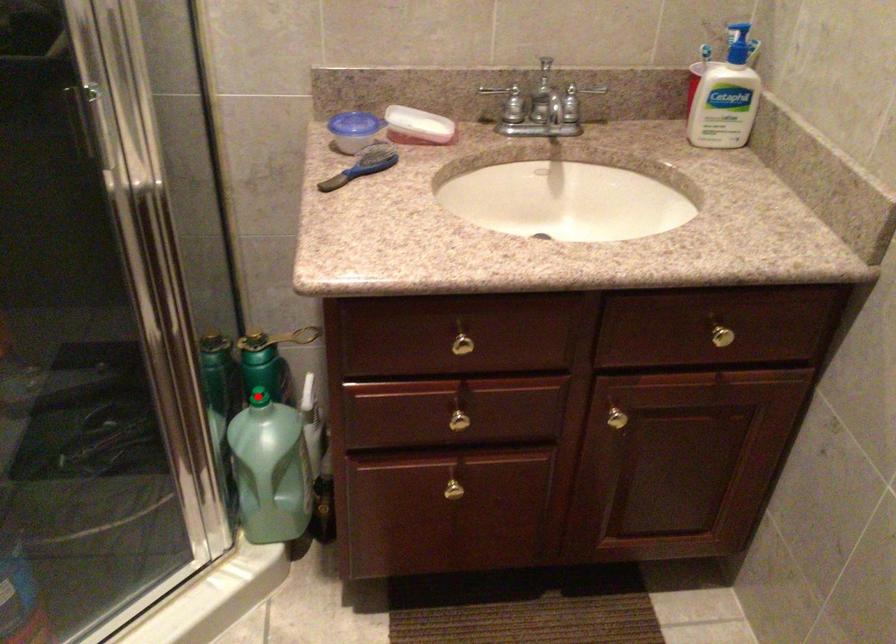
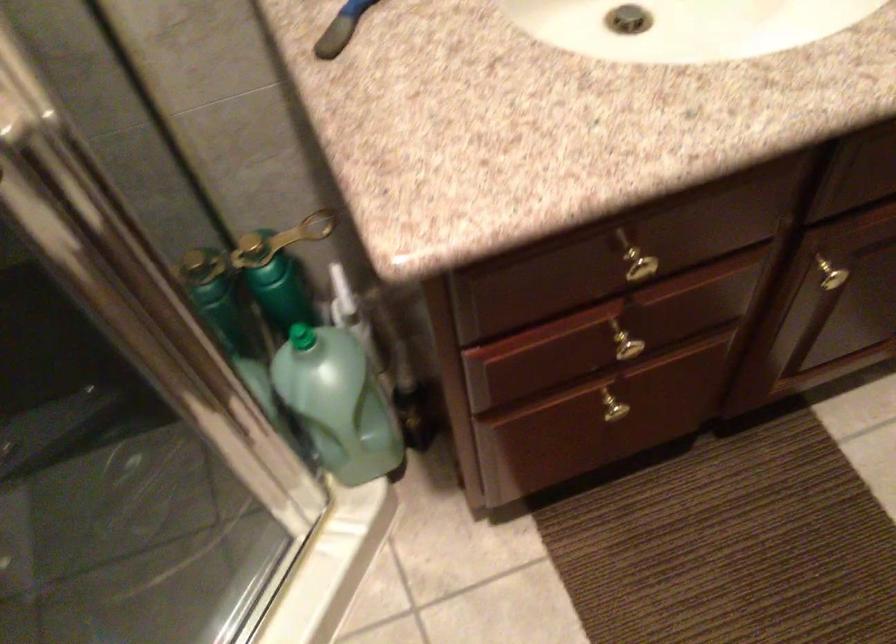
Question: I am providing you with two images of the same scene from different viewpoints. Image1 has a red point marked. In image2, the corresponding 3D location appears at what relative position? Reply with the corresponding letter.

Choices:
 (A) Closer
 (B) Farther

Answer: (A)